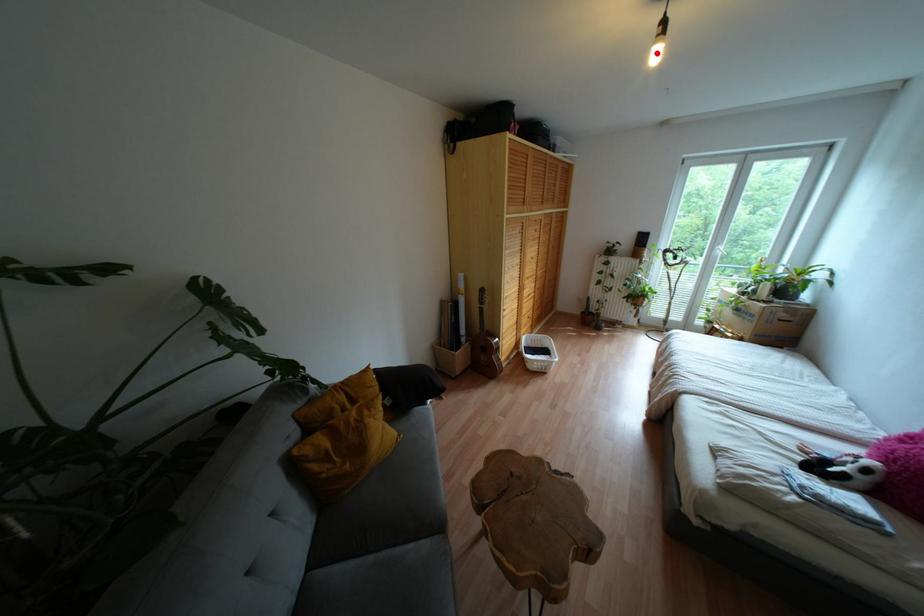
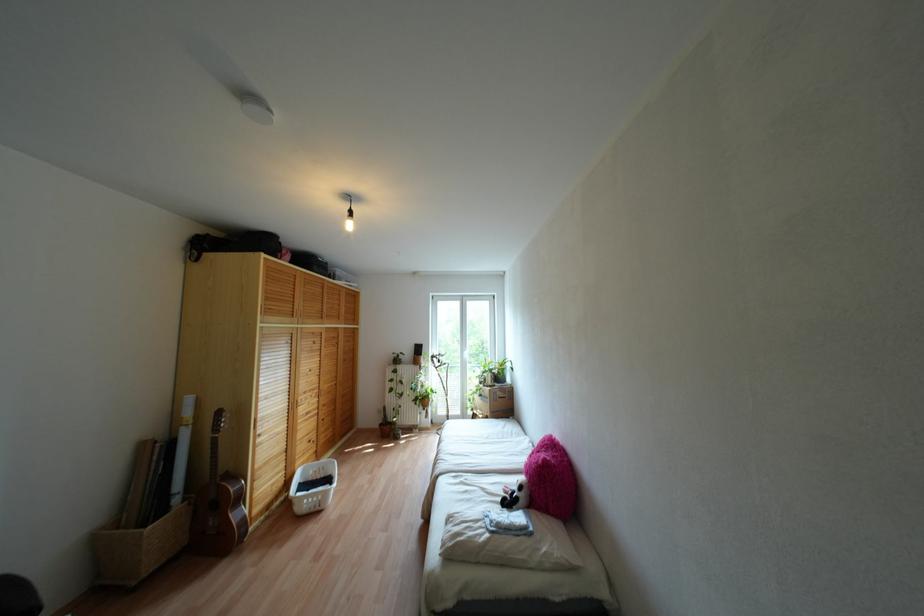
The point at the highlighted location is marked in the first image. Where is the corresponding point in the second image?

(348, 225)